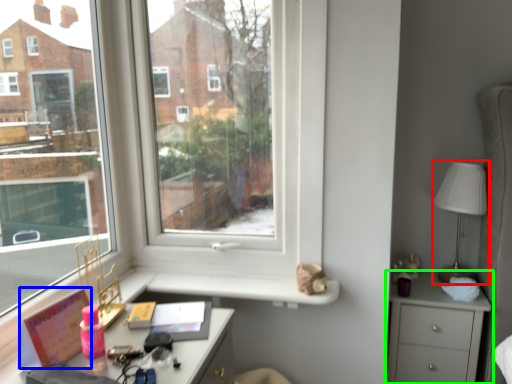
Question: Which object is positioned farthest from table lamp (highlighted by a red box)? Select from book (highlighted by a blue box) and chest of drawers (highlighted by a green box).

Choices:
 (A) book
 (B) chest of drawers

Answer: (A)